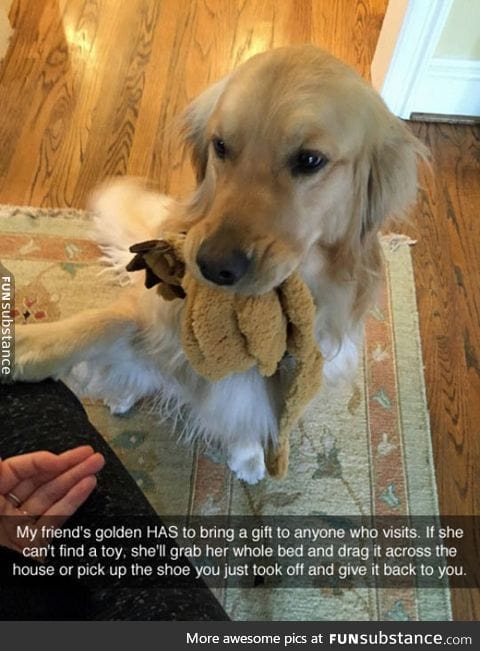
Locate an element on the screen. This screenshot has width=480, height=651. white fur is located at coordinates (240, 396).